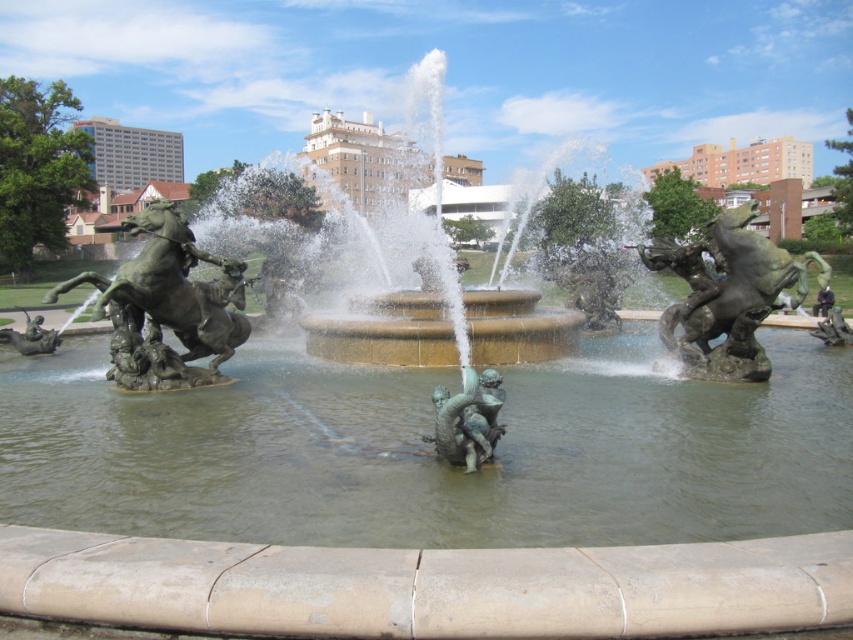
Is point (165, 269) behind point (38, 326)?

No, (165, 269) is closer to viewer.

Which of these two, bronze/golden horse at left or bronze statue at lower left, stands taller?

Standing taller between the two is bronze/golden horse at left.

Which is in front, point (140, 317) or point (44, 342)?

Point (140, 317) is more forward.

Find the location of a particular element. The width and height of the screenshot is (853, 640). bronze/golden horse at left is located at coordinates (166, 307).

Who is more distant from viewer, (x=469, y=381) or (x=828, y=314)?

Positioned behind is point (x=828, y=314).

This screenshot has width=853, height=640. Identify the location of green patina bronze children at center. (468, 419).

Looking at this image, can you confirm if bronze/golden horse at right is positioned below green patina bronze children at center?

Incorrect, bronze/golden horse at right is not positioned below green patina bronze children at center.

Is bronze/golden horse at right to the right of green patina bronze children at center from the viewer's perspective?

Yes, bronze/golden horse at right is to the right of green patina bronze children at center.

What do you see at coordinates (727, 296) in the screenshot? This screenshot has height=640, width=853. I see `bronze/golden horse at right` at bounding box center [727, 296].

At what (x,y) coordinates should I click in order to perform the action: click on bronze/golden horse at right. Please return your answer as a coordinate pair (x, y). Looking at the image, I should click on (727, 296).